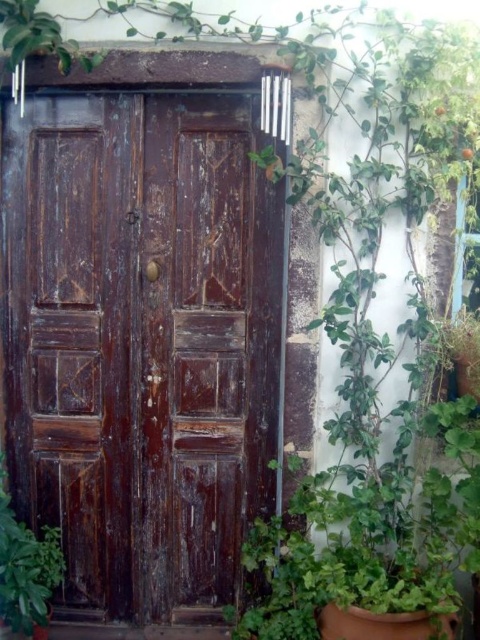
You are standing in front of the weathered wood door at center and want to reach the green leafy plant at lower left. Can you walk directly to it without moving the door?

The green leafy plant at lower left is behind the weathered wood door at center, so you cannot walk directly to it without moving the door first.

You are trying to determine if the weathered wood door at center can fit through a narrow doorway that is currently occupied by the green leafy plant at lower left. Based on their sizes, is this possible?

The weathered wood door at center might be wider than green leafy plant at lower left, so it may not fit through the narrow doorway occupied by the green leafy plant at lower left.

You are standing in front of the weathered wood door at center and the green leafy plant at lower left. Which object is closer to your right side?

The weathered wood door at center is to the right of green leafy plant at lower left, so it is closer to your right side.